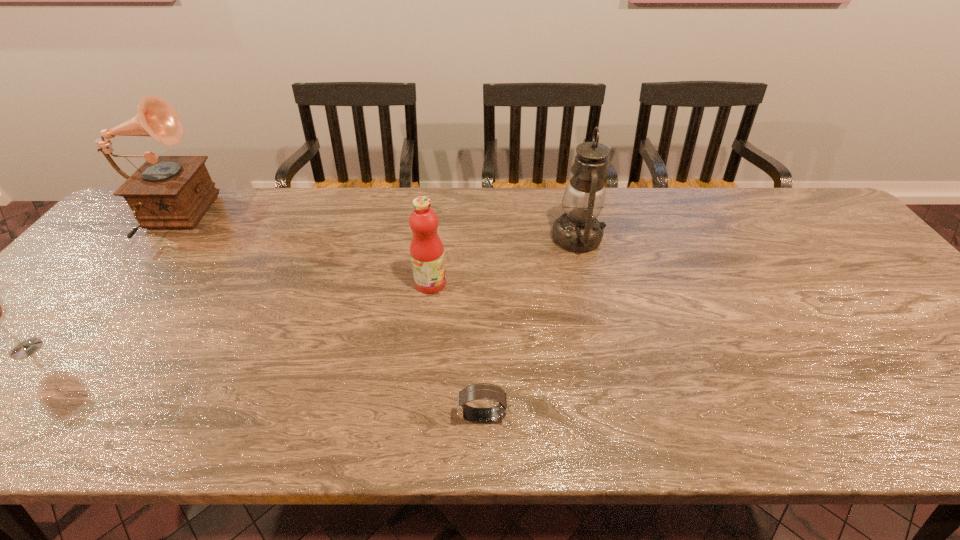
This screenshot has height=540, width=960. I want to click on vacant space located 0.400m on the face of the watch, so click(258, 417).

Image resolution: width=960 pixels, height=540 pixels. I want to click on vacant space located on the face of the watch, so click(x=428, y=417).

The width and height of the screenshot is (960, 540). What are the coordinates of `record player positioned at the far edge` in the screenshot? It's located at (166, 192).

In order to click on oil lamp that is at the far edge in this screenshot , I will do `click(578, 230)`.

This screenshot has width=960, height=540. In order to click on object situated at the near edge in this screenshot , I will do `click(479, 391)`.

The image size is (960, 540). Identify the location of object located at the left edge. (166, 192).

This screenshot has height=540, width=960. Find the location of `object at the far left corner`. object at the far left corner is located at coordinates (166, 192).

In the image, there is a desktop. Identify the location of vacant space at the far edge. This screenshot has width=960, height=540. (689, 212).

This screenshot has width=960, height=540. What are the coordinates of `vacant space at the near edge` in the screenshot? It's located at (441, 437).

Locate an element on the screen. vacant space at the left edge of the desktop is located at coordinates (15, 391).